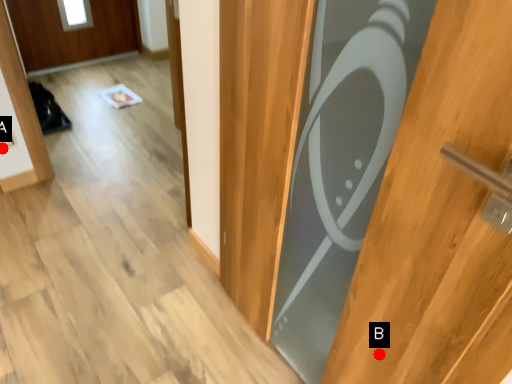
Question: Two points are circled on the image, labeled by A and B beside each circle. Which point appears closest to the camera in this image?

Choices:
 (A) A is closer
 (B) B is closer

Answer: (B)